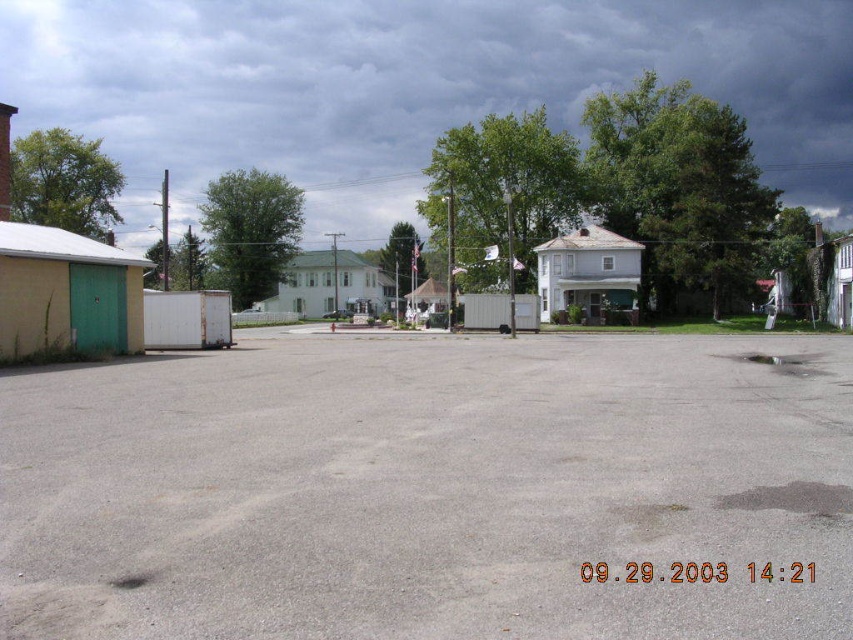
Question: Which of the following is the farthest from the observer?

Choices:
 (A) dark cloudy sky at upper center
 (B) gray concrete parking lot at center

Answer: (A)

Question: Is gray concrete parking lot at center thinner than dark cloudy sky at upper center?

Choices:
 (A) no
 (B) yes

Answer: (B)

Question: Among these objects, which one is farthest from the camera?

Choices:
 (A) gray concrete parking lot at center
 (B) dark cloudy sky at upper center

Answer: (B)

Question: Is gray concrete parking lot at center positioned before dark cloudy sky at upper center?

Choices:
 (A) yes
 (B) no

Answer: (A)

Question: Can you confirm if gray concrete parking lot at center is bigger than dark cloudy sky at upper center?

Choices:
 (A) no
 (B) yes

Answer: (A)